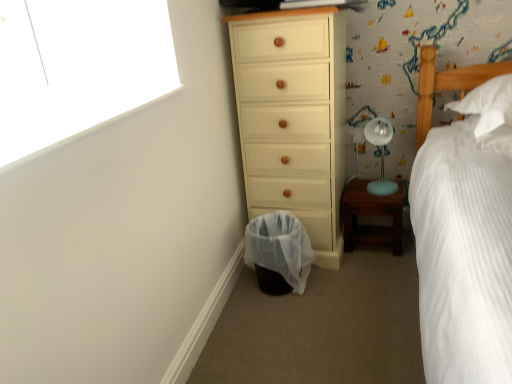
The width and height of the screenshot is (512, 384). I want to click on vacant area that lies between matte cream chest of drawers at center and translucent plastic laundry basket at lower center, so click(317, 284).